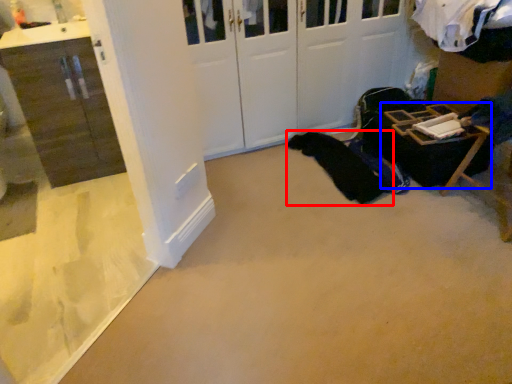
Question: Among these objects, which one is nearest to the camera, clothing (highlighted by a red box) or furniture (highlighted by a blue box)?

Choices:
 (A) clothing
 (B) furniture

Answer: (B)